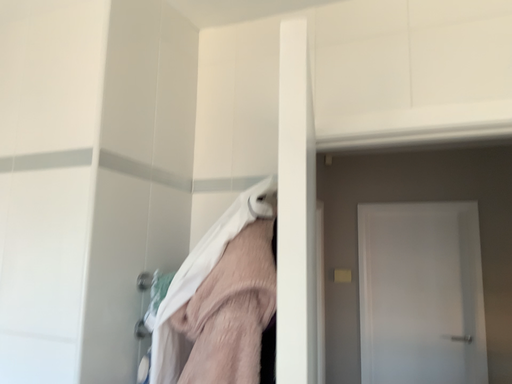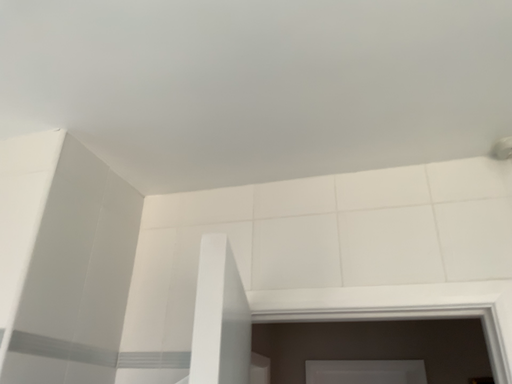
Question: How did the camera likely rotate when shooting the video?

Choices:
 (A) rotated left
 (B) rotated right

Answer: (B)